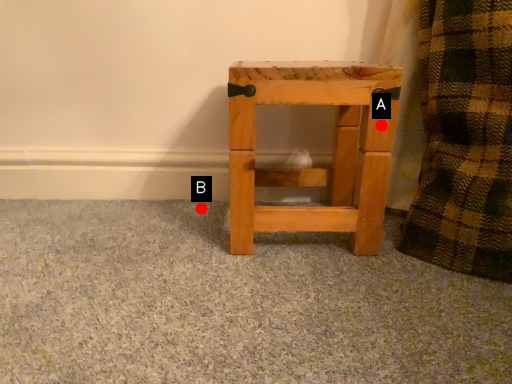
Question: Two points are circled on the image, labeled by A and B beside each circle. Which point is farther from the camera taking this photo?

Choices:
 (A) A is further
 (B) B is further

Answer: (B)